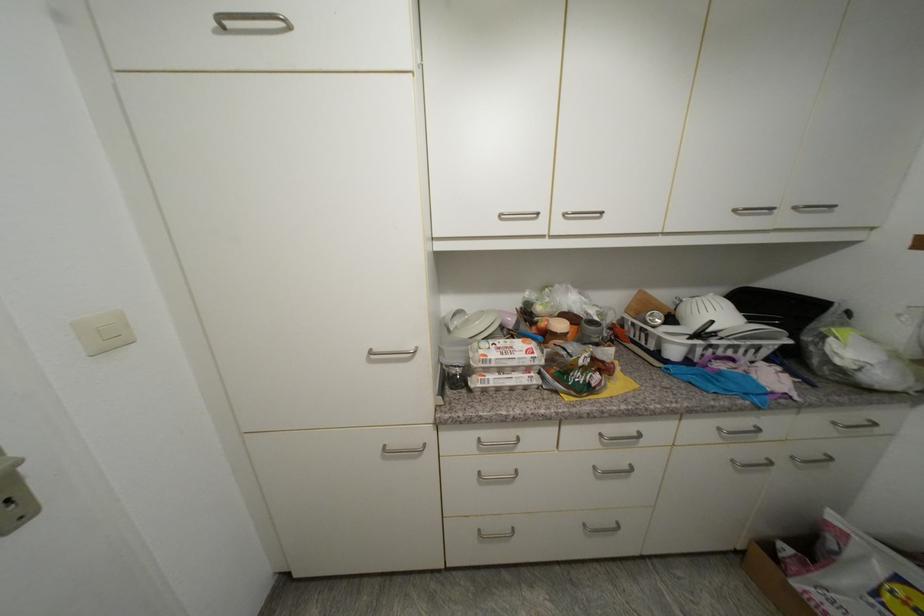
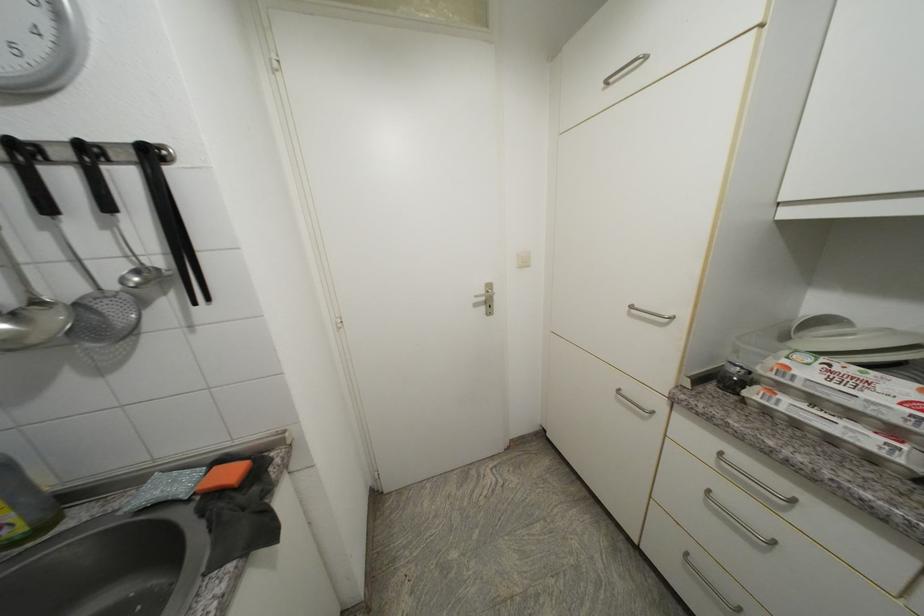
Question: The images are taken continuously from a first-person perspective. In which direction is your viewpoint rotating?

Choices:
 (A) Left
 (B) Right
 (C) Up
 (D) Down

Answer: (A)